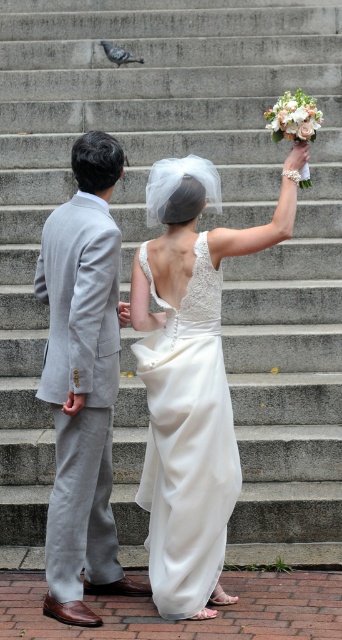
Question: Considering the relative positions of white satin dress at center and light gray suit at left in the image provided, where is white satin dress at center located with respect to light gray suit at left?

Choices:
 (A) right
 (B) left

Answer: (A)

Question: Can you confirm if white satin dress at center is bigger than gray feathered pigeon at upper center?

Choices:
 (A) yes
 (B) no

Answer: (A)

Question: Is white satin dress at center behind light gray suit at left?

Choices:
 (A) no
 (B) yes

Answer: (B)

Question: Which object is farther from the camera taking this photo?

Choices:
 (A) white lace dress at center
 (B) white satin dress at center
 (C) light gray suit at left
 (D) gray feathered pigeon at upper center

Answer: (D)

Question: Which point is closer to the camera?

Choices:
 (A) (108, 54)
 (B) (169, 317)
 (C) (136, 314)

Answer: (B)

Question: Which point is farther to the camera?

Choices:
 (A) white satin dress at center
 (B) gray feathered pigeon at upper center
 (C) light gray suit at left

Answer: (B)